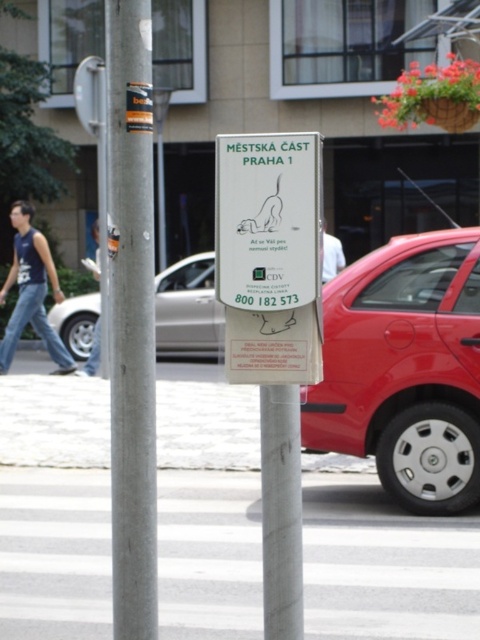
In the scene shown: Is metallic red car at right below blue denim jeans at lower left?

Yes, metallic red car at right is below blue denim jeans at lower left.

Is point (330, 356) behind point (35, 252)?

No, it is in front of (35, 252).

Who is more forward, (472, 465) or (15, 257)?

Point (472, 465) is more forward.

At what (x,y) coordinates should I click in order to perform the action: click on metallic red car at right. Please return your answer as a coordinate pair (x, y). Looking at the image, I should click on pos(405,369).

Does silver metallic pole at left have a larger size compared to silver metallic sedan at center?

Actually, silver metallic pole at left might be smaller than silver metallic sedan at center.

Is point (151, 445) behind point (71, 326)?

No.

The image size is (480, 640). I want to click on silver metallic pole at left, so click(x=131, y=317).

Which is in front, point (119, 317) or point (336, 253)?

Positioned in front is point (119, 317).

Measure the distance from silver metallic pole at left to white fabric shirt at upper center.

Answer: A distance of 3.41 meters exists between silver metallic pole at left and white fabric shirt at upper center.

Where is `silver metallic pole at left`? The width and height of the screenshot is (480, 640). silver metallic pole at left is located at coordinates (131, 317).

The image size is (480, 640). Identify the location of silver metallic pole at left. (131, 317).